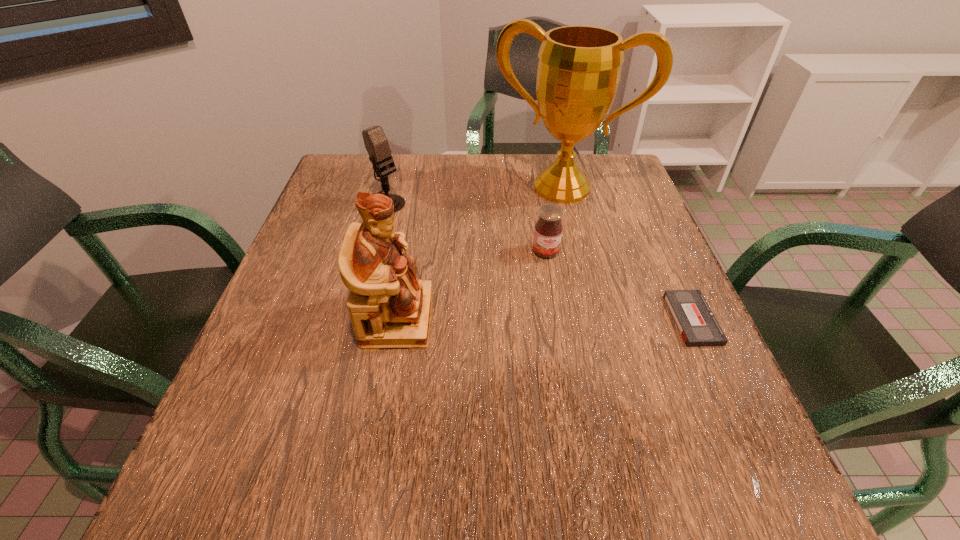
I want to click on the fourth shortest object, so click(x=389, y=307).

Where is `videotape`? videotape is located at coordinates (x=696, y=323).

The height and width of the screenshot is (540, 960). In order to click on jam in this screenshot , I will do `click(548, 230)`.

Image resolution: width=960 pixels, height=540 pixels. I want to click on the second shortest object, so click(548, 230).

Where is `the tallest object`? Image resolution: width=960 pixels, height=540 pixels. the tallest object is located at coordinates (579, 68).

Identify the location of the third tallest object. The height and width of the screenshot is (540, 960). (376, 143).

This screenshot has width=960, height=540. Identify the location of vacant space situated on the front-facing side of the figurine. (564, 319).

The image size is (960, 540). What are the coordinates of `free space located 0.050m on the back of the videotape` in the screenshot? It's located at pyautogui.click(x=674, y=279).

Where is `vacant space located on the label side of the third nearest object`? vacant space located on the label side of the third nearest object is located at coordinates (582, 393).

In order to click on free spot located 0.310m on the label side of the third nearest object in this screenshot , I will do `click(576, 370)`.